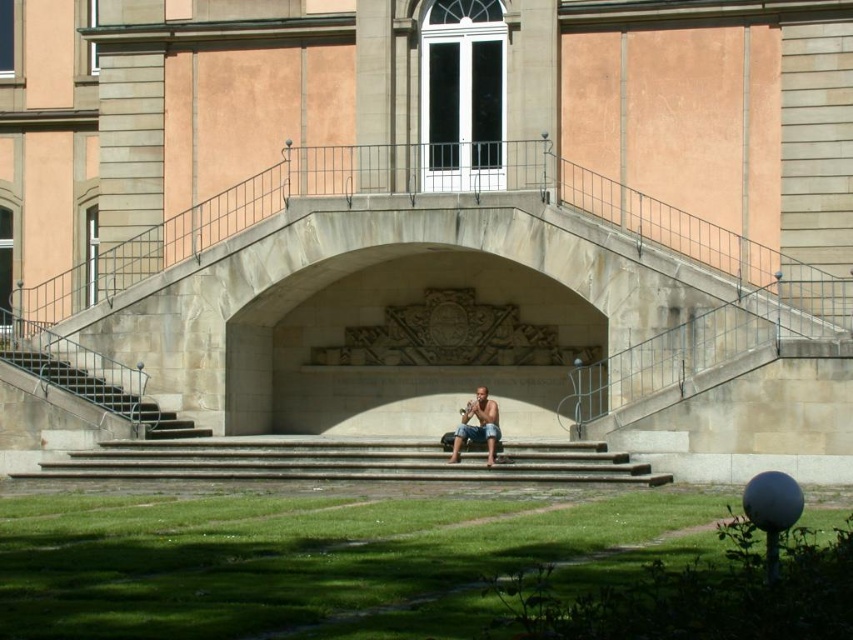
You are standing at the base of the concrete stairs at center and want to reach the tan skin person at center who is playing music. Which direction should you move to get closer to them?

The concrete stairs at center is located below the tan skin person at center, so you should move upward along the concrete stairs at center to reach them.

You are standing at the base of the stone archway and want to reach the man sitting on the steps. Which point, point (610, 480) or point (492, 404), is closer to you?

Point (610, 480) is closer to the viewer than point (492, 404), so you should head towards point (610, 480) to reach the man more quickly.

You are planning to climb the stairs to reach the building. Which stairs, the concrete stairs at center or the smooth stone stairs at lower left, would require fewer steps to reach the top?

The concrete stairs at center has a lesser height compared to smooth stone stairs at lower left, so the concrete stairs at center would require fewer steps to reach the top.